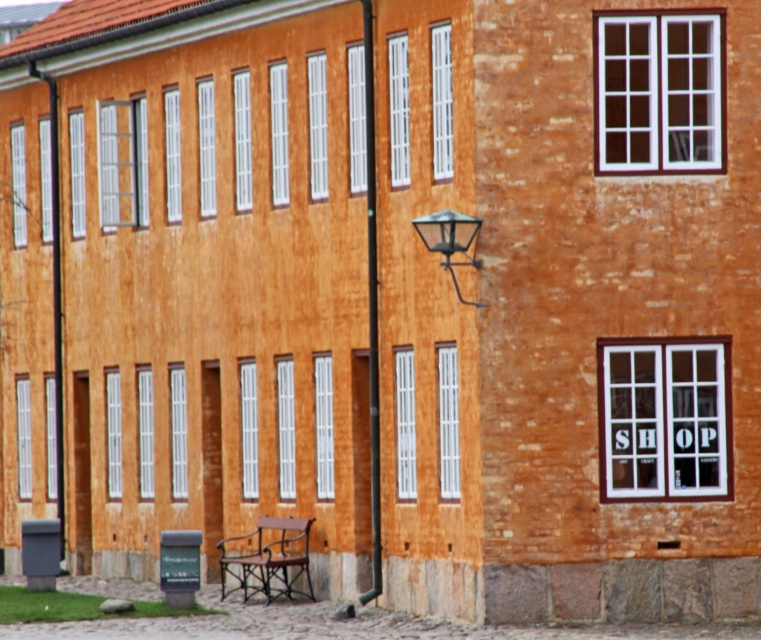
Question: Is wooden park bench at lower center further to camera compared to metallic black lamp post at left?

Choices:
 (A) no
 (B) yes

Answer: (A)

Question: Is wooden park bench at lower center below black glass lamp at center?

Choices:
 (A) no
 (B) yes

Answer: (B)

Question: Which object is positioned farthest from the black glass lamp at center?

Choices:
 (A) wooden park bench at lower center
 (B) metallic black lamp post at left

Answer: (B)

Question: Which point is closer to the camera taking this photo?

Choices:
 (A) (252, 588)
 (B) (428, 240)
 (C) (59, 467)

Answer: (B)

Question: Which point is closer to the camera?

Choices:
 (A) wooden park bench at lower center
 (B) black glass lamp at center

Answer: (B)

Question: Does metallic black lamp post at left appear over black glass lamp at center?

Choices:
 (A) no
 (B) yes

Answer: (A)